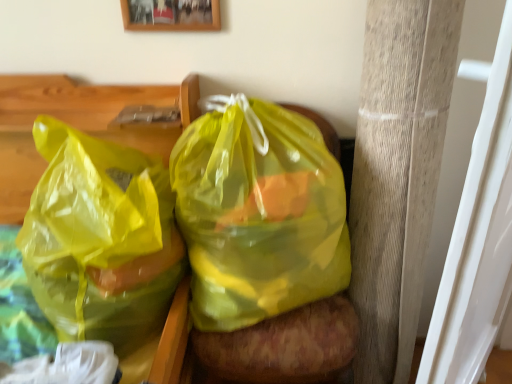
Question: Should I look upward or downward to see wooden pillar at right?

Choices:
 (A) down
 (B) up

Answer: (A)

Question: Is wooden picture frame at upper center far from wooden pillar at right?

Choices:
 (A) yes
 (B) no

Answer: (B)

Question: From the image's perspective, would you say wooden picture frame at upper center is shown under wooden pillar at right?

Choices:
 (A) no
 (B) yes

Answer: (A)

Question: Does wooden picture frame at upper center have a larger size compared to wooden pillar at right?

Choices:
 (A) yes
 (B) no

Answer: (B)

Question: Is wooden picture frame at upper center smaller than wooden pillar at right?

Choices:
 (A) no
 (B) yes

Answer: (B)

Question: Does wooden picture frame at upper center contain wooden pillar at right?

Choices:
 (A) no
 (B) yes

Answer: (A)

Question: Does wooden picture frame at upper center have a lesser width compared to wooden pillar at right?

Choices:
 (A) yes
 (B) no

Answer: (A)

Question: From the image's perspective, is wooden picture frame at upper center located beneath translucent yellow plastic bag at center, which appears as the 2th plastic bag when viewed from the left?

Choices:
 (A) no
 (B) yes

Answer: (A)

Question: Is wooden picture frame at upper center far from translucent yellow plastic bag at center, the 1th plastic bag viewed from the right?

Choices:
 (A) no
 (B) yes

Answer: (A)

Question: From a real-world perspective, is wooden picture frame at upper center over translucent yellow plastic bag at center, which appears as the 2th plastic bag when viewed from the left?

Choices:
 (A) no
 (B) yes

Answer: (B)

Question: Does wooden picture frame at upper center have a larger size compared to translucent yellow plastic bag at center, which appears as the 2th plastic bag when viewed from the left?

Choices:
 (A) yes
 (B) no

Answer: (B)

Question: Does wooden picture frame at upper center have a greater height compared to translucent yellow plastic bag at center, which appears as the 2th plastic bag when viewed from the left?

Choices:
 (A) no
 (B) yes

Answer: (A)

Question: Is wooden picture frame at upper center closer to the viewer compared to translucent yellow plastic bag at center, the 1th plastic bag viewed from the right?

Choices:
 (A) no
 (B) yes

Answer: (A)

Question: Does wooden pillar at right have a larger size compared to wooden picture frame at upper center?

Choices:
 (A) no
 (B) yes

Answer: (B)